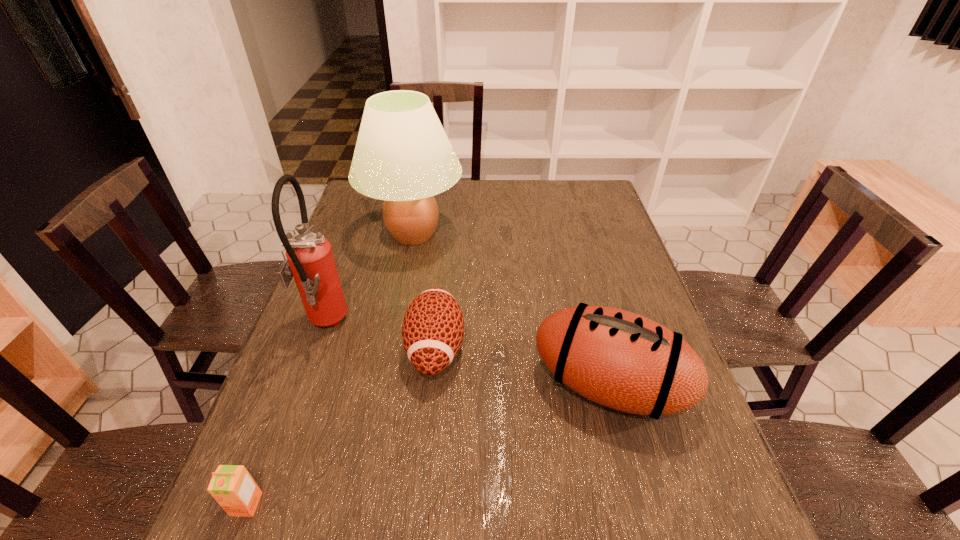
Locate an element on the screen. Image resolution: width=960 pixels, height=540 pixels. vacant space in between the shorter football and the orange juice is located at coordinates (341, 426).

The width and height of the screenshot is (960, 540). I want to click on free spot between the farthest object and the fire extinguisher, so click(x=369, y=280).

Find the location of a particular element. vacant area between the right football and the left football is located at coordinates (522, 367).

Locate an element on the screen. vacant region between the nearest object and the fire extinguisher is located at coordinates (285, 415).

Identify the location of object identified as the third closest to the shorter football. (403, 156).

This screenshot has height=540, width=960. Find the location of `object identified as the closest to the fourth tallest object`. object identified as the closest to the fourth tallest object is located at coordinates (619, 359).

The width and height of the screenshot is (960, 540). I want to click on free space that satisfies the following two spatial constraints: 1. on the shade of the farthest object; 2. on the back side of the right football, so click(x=384, y=386).

I want to click on vacant space that satisfies the following two spatial constraints: 1. at the nozzle of the fire extinguisher; 2. on the right side of the taller football, so click(302, 386).

I want to click on free region that satisfies the following two spatial constraints: 1. on the shade of the lampshade; 2. on the back side of the fourth tallest object, so click(392, 348).

The image size is (960, 540). Find the location of `free space that satisfies the following two spatial constraints: 1. on the back side of the taller football; 2. at the nozzle of the fire extinguisher`. free space that satisfies the following two spatial constraints: 1. on the back side of the taller football; 2. at the nozzle of the fire extinguisher is located at coordinates (593, 326).